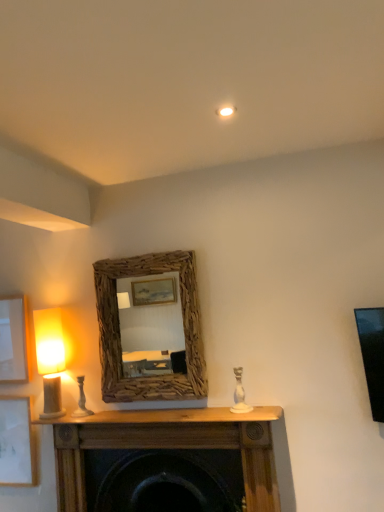
Question: From the image's perspective, would you say white ceramic candle holder at center, acting as the second candle holder starting from the back, is positioned over white matte picture frame at lower left, which is counted as the second picture frame, starting from the top?

Choices:
 (A) no
 (B) yes

Answer: (B)

Question: Considering the relative sizes of white ceramic candle holder at center, which is counted as the 2th candle holder, starting from the left, and white matte picture frame at lower left, which is the 1th picture frame from bottom to top, in the image provided, is white ceramic candle holder at center, which is counted as the 2th candle holder, starting from the left, shorter than white matte picture frame at lower left, which is the 1th picture frame from bottom to top,?

Choices:
 (A) no
 (B) yes

Answer: (B)

Question: Can we say white ceramic candle holder at center, arranged as the first candle holder when viewed from the right, lies outside white matte picture frame at lower left, which is counted as the second picture frame, starting from the top?

Choices:
 (A) no
 (B) yes

Answer: (B)

Question: Does white ceramic candle holder at center, which ranks as the 1th candle holder in front-to-back order, appear on the left side of white matte picture frame at lower left, which is the 1th picture frame from bottom to top?

Choices:
 (A) yes
 (B) no

Answer: (B)

Question: From the image's perspective, is white ceramic candle holder at center, arranged as the first candle holder when viewed from the right, located beneath white matte picture frame at lower left, which is the 1th picture frame from bottom to top?

Choices:
 (A) yes
 (B) no

Answer: (B)

Question: From a real-world perspective, is matte beige lampshade at left positioned above or below white ceramic candle holder at center, which is counted as the 2th candle holder, starting from the left?

Choices:
 (A) below
 (B) above

Answer: (B)

Question: Is matte beige lampshade at left to the left or to the right of white ceramic candle holder at center, arranged as the first candle holder when viewed from the right, in the image?

Choices:
 (A) right
 (B) left

Answer: (B)

Question: From their relative heights in the image, would you say matte beige lampshade at left is taller or shorter than white ceramic candle holder at center, arranged as the first candle holder when viewed from the right?

Choices:
 (A) tall
 (B) short

Answer: (A)

Question: Is matte beige lampshade at left wider or thinner than white ceramic candle holder at center, which ranks as the 1th candle holder in front-to-back order?

Choices:
 (A) wide
 (B) thin

Answer: (A)

Question: Is white ceramic candle holder at left, positioned as the second candle holder in right-to-left order, bigger or smaller than white matte picture frame at lower left, which is the 1th picture frame from bottom to top?

Choices:
 (A) small
 (B) big

Answer: (A)

Question: In the image, is white ceramic candle holder at left, the first candle holder in the left-to-right sequence, on the left side or the right side of white matte picture frame at lower left, which is the 1th picture frame from bottom to top?

Choices:
 (A) right
 (B) left

Answer: (A)

Question: From a real-world perspective, is white ceramic candle holder at left, positioned as the second candle holder in right-to-left order, above or below white matte picture frame at lower left, which is counted as the second picture frame, starting from the top?

Choices:
 (A) below
 (B) above

Answer: (B)

Question: Is point (81, 408) closer or farther from the camera than point (11, 437)?

Choices:
 (A) closer
 (B) farther

Answer: (A)

Question: Is point (79, 379) closer or farther from the camera than point (24, 375)?

Choices:
 (A) closer
 (B) farther

Answer: (A)

Question: Considering the positions of white ceramic candle holder at left, the first candle holder in the left-to-right sequence, and matte white picture frame at left, the 2th picture frame ordered from the bottom, in the image, is white ceramic candle holder at left, the first candle holder in the left-to-right sequence, wider or thinner than matte white picture frame at left, the 2th picture frame ordered from the bottom,?

Choices:
 (A) wide
 (B) thin

Answer: (A)